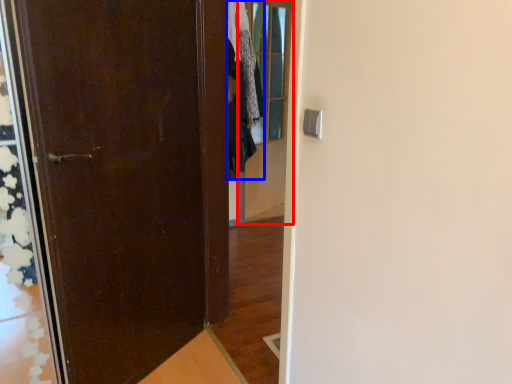
Question: Which of the following is the farthest to the observer, glass door (highlighted by a red box) or clothing (highlighted by a blue box)?

Choices:
 (A) glass door
 (B) clothing

Answer: (A)